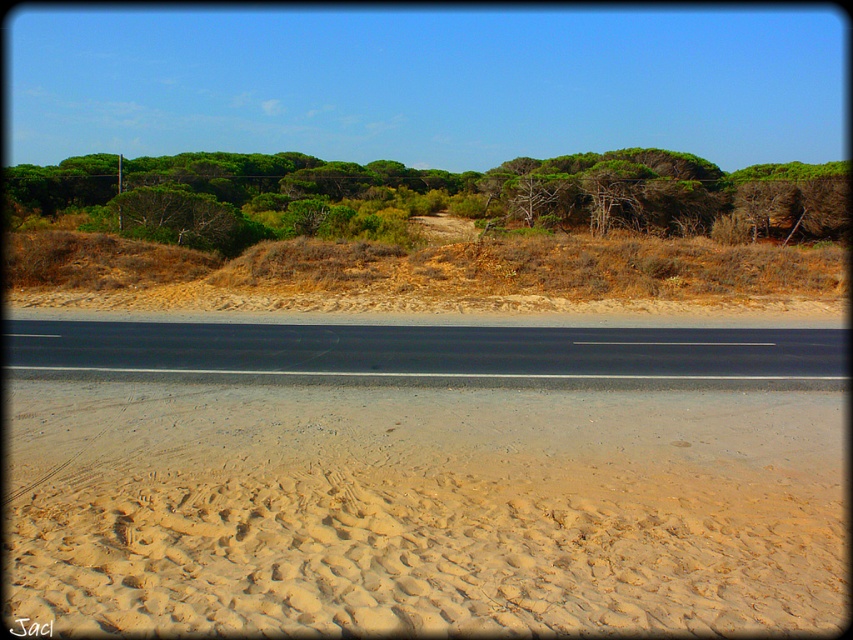
A drone is flying at a point (824, 173) and needs to deliver a package to a location 52.64 meters away. Given the scene described, where would the drone drop the package?

The drone should drop the package at the road since the point (824, 173) is 52.64 meters away from the road.

You are standing at the point marked by coordinates point (424, 509). Based on the scene description, what type of terrain are you currently standing on?

The point (424, 509) corresponds to the light brown sandy beach at lower center, so you are standing on sandy terrain.